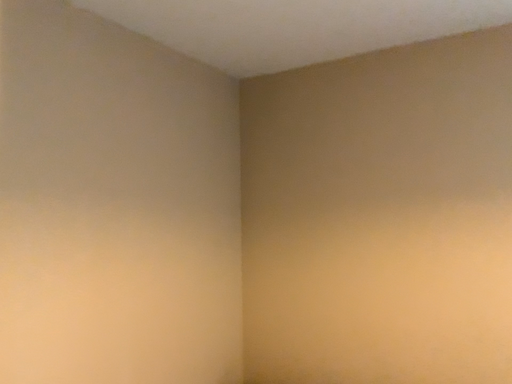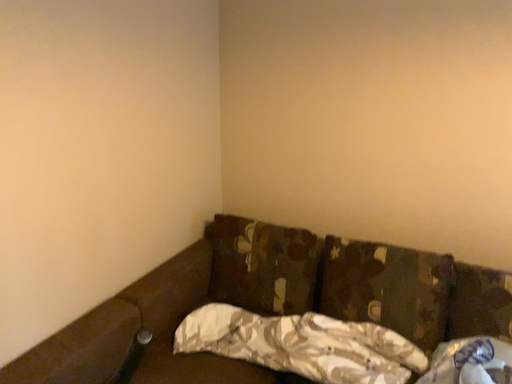
Question: How did the camera likely rotate when shooting the video?

Choices:
 (A) rotated upward
 (B) rotated downward

Answer: (B)